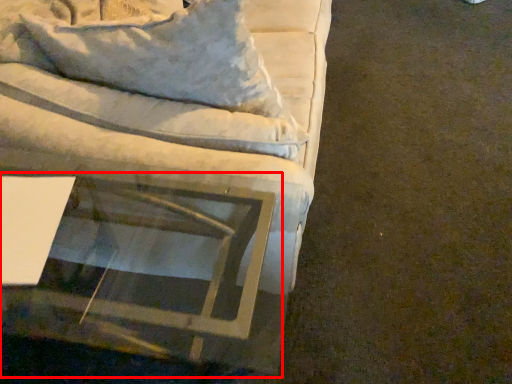
Question: From the image's perspective, where is round table (annotated by the red box) located relative to studio couch?

Choices:
 (A) above
 (B) below

Answer: (B)